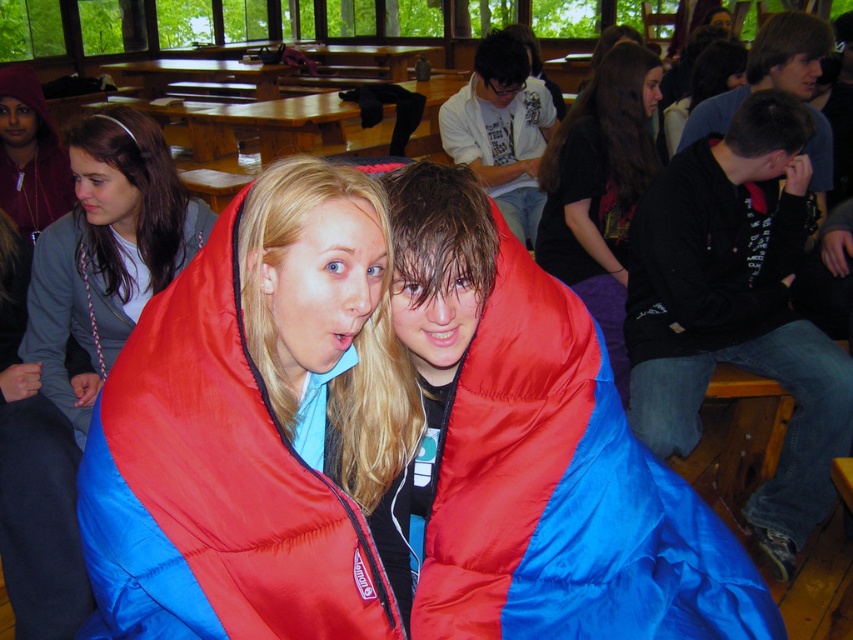
Question: Which object appears farthest from the camera in this image?

Choices:
 (A) red nylon sleeping bag at center
 (B) red/blue quilted sleeping bag at center
 (C) black fabric sleeping bag at center

Answer: (C)

Question: Is red nylon sleeping bag at center wider than black fabric sleeping bag at center?

Choices:
 (A) yes
 (B) no

Answer: (B)

Question: Which object appears closest to the camera in this image?

Choices:
 (A) matte blue sleeping bag at center
 (B) dark blue shirt at upper right

Answer: (A)

Question: Does white matte shirt at center have a smaller size compared to dark blue shirt at upper right?

Choices:
 (A) yes
 (B) no

Answer: (B)

Question: Does red/blue quilted sleeping bag at center appear under black fabric sleeping bag at center?

Choices:
 (A) yes
 (B) no

Answer: (A)

Question: Which of these objects is positioned closest to the dark blue shirt at upper right?

Choices:
 (A) matte blue sleeping bag at center
 (B) white matte shirt at center

Answer: (B)